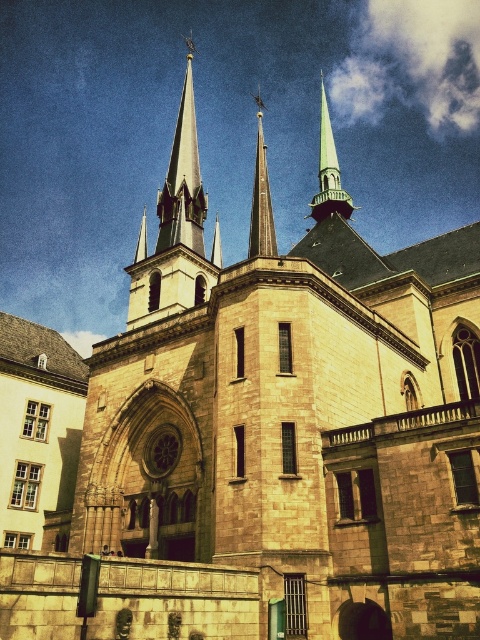
Question: Which of these objects is positioned closest to the smooth gray spire at center?

Choices:
 (A) smooth gray spire at upper center
 (B) shiny silver spire at upper center

Answer: (B)

Question: Which point is closer to the camera taking this photo?

Choices:
 (A) (188, 93)
 (B) (266, 212)

Answer: (B)

Question: Among these points, which one is farthest from the camera?

Choices:
 (A) (173, 241)
 (B) (268, 241)

Answer: (A)

Question: Is smooth gray spire at upper center bigger than smooth gray spire at center?

Choices:
 (A) yes
 (B) no

Answer: (A)

Question: Can you confirm if smooth gray spire at upper center is thinner than smooth gray spire at center?

Choices:
 (A) no
 (B) yes

Answer: (A)

Question: Considering the relative positions of shiny silver spire at upper center and smooth gray spire at center in the image provided, where is shiny silver spire at upper center located with respect to smooth gray spire at center?

Choices:
 (A) right
 (B) left

Answer: (A)